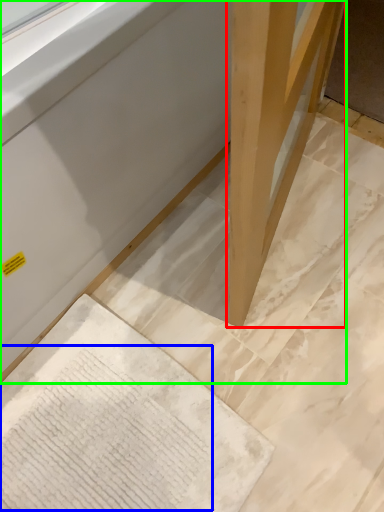
Question: Which is farther away from wood (highlighted by a red box)? writing (highlighted by a blue box) or furniture (highlighted by a green box)?

Choices:
 (A) writing
 (B) furniture

Answer: (A)